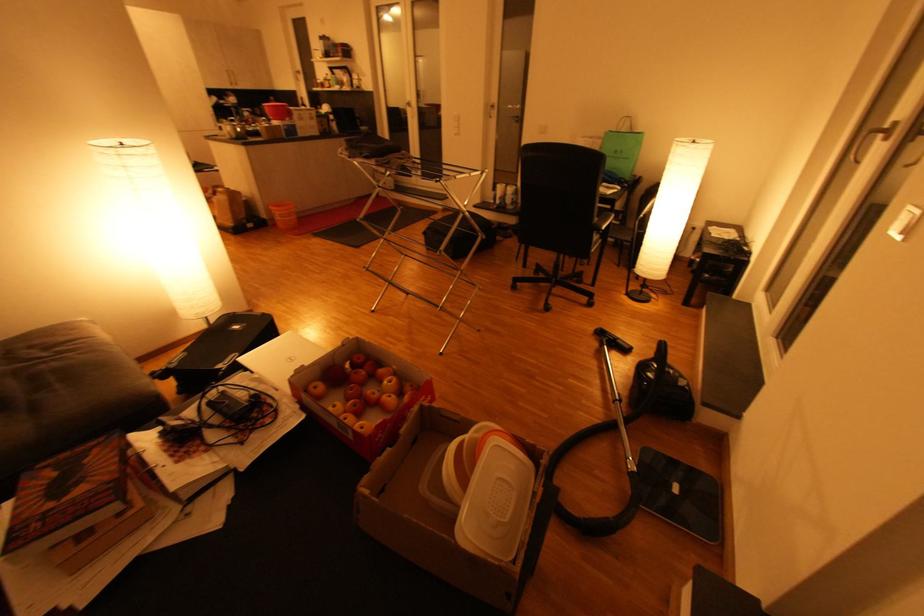
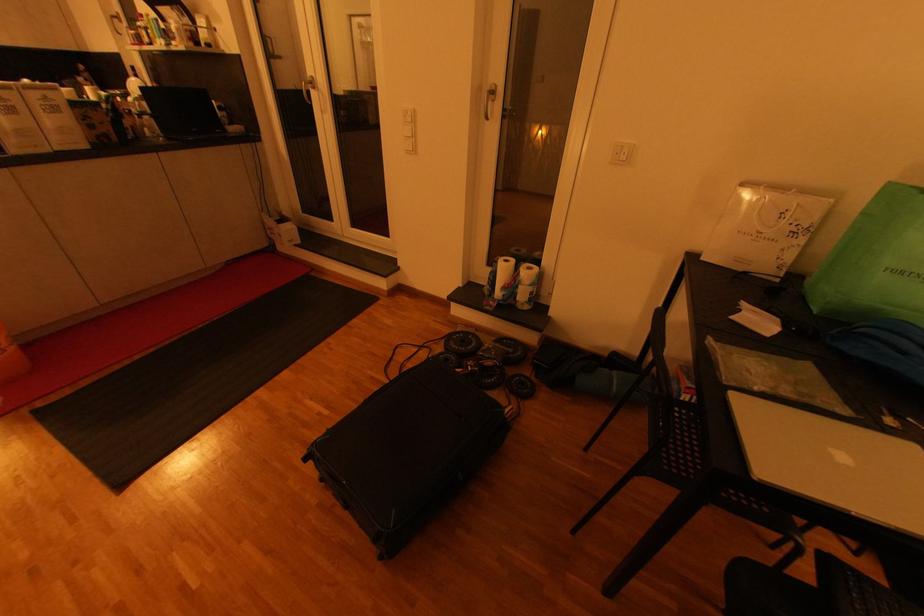
The point at (502, 188) is marked in the first image. Where is the corresponding point in the second image?

(502, 262)